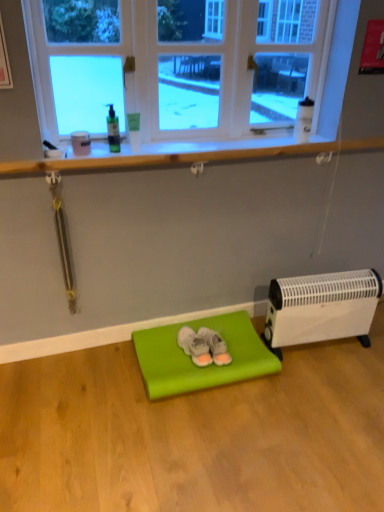
Question: Is gray suede slippers at center, acting as the 1th footwear starting from the left, bigger than white plastic heater at lower right?

Choices:
 (A) no
 (B) yes

Answer: (A)

Question: Does gray suede slippers at center, acting as the 1th footwear starting from the left, come behind white plastic heater at lower right?

Choices:
 (A) no
 (B) yes

Answer: (B)

Question: Considering the relative sizes of gray suede slippers at center, acting as the 2th footwear starting from the right, and white plastic heater at lower right in the image provided, is gray suede slippers at center, acting as the 2th footwear starting from the right, smaller than white plastic heater at lower right?

Choices:
 (A) no
 (B) yes

Answer: (B)

Question: Does gray suede slippers at center, acting as the 1th footwear starting from the left, have a lesser height compared to white plastic heater at lower right?

Choices:
 (A) no
 (B) yes

Answer: (B)

Question: Could you tell me if gray suede slippers at center, acting as the 1th footwear starting from the left, is facing white plastic heater at lower right?

Choices:
 (A) no
 (B) yes

Answer: (A)

Question: From the image's perspective, is matte green yoga mat at center above or below white suede sneakers at center, the second footwear in the left-to-right sequence?

Choices:
 (A) below
 (B) above

Answer: (A)

Question: From their relative heights in the image, would you say matte green yoga mat at center is taller or shorter than white suede sneakers at center, which is the 1th footwear in right-to-left order?

Choices:
 (A) tall
 (B) short

Answer: (B)

Question: Considering the positions of matte green yoga mat at center and white suede sneakers at center, which is the 1th footwear in right-to-left order, in the image, is matte green yoga mat at center bigger or smaller than white suede sneakers at center, which is the 1th footwear in right-to-left order,?

Choices:
 (A) small
 (B) big

Answer: (B)

Question: Relative to white suede sneakers at center, which is the 1th footwear in right-to-left order, is matte green yoga mat at center in front or behind?

Choices:
 (A) behind
 (B) front

Answer: (B)

Question: Is clear glass window at upper center wider or thinner than white suede sneakers at center, the second footwear in the left-to-right sequence?

Choices:
 (A) wide
 (B) thin

Answer: (B)

Question: Is clear glass window at upper center in front of or behind white suede sneakers at center, which is the 1th footwear in right-to-left order, in the image?

Choices:
 (A) front
 (B) behind

Answer: (A)

Question: From the image's perspective, is clear glass window at upper center located above or below white suede sneakers at center, which is the 1th footwear in right-to-left order?

Choices:
 (A) above
 (B) below

Answer: (A)

Question: Is clear glass window at upper center taller or shorter than white suede sneakers at center, the second footwear in the left-to-right sequence?

Choices:
 (A) tall
 (B) short

Answer: (A)

Question: From a real-world perspective, is clear glass window at upper center positioned above or below matte green yoga mat at center?

Choices:
 (A) above
 (B) below

Answer: (A)

Question: Considering the positions of point (187, 112) and point (178, 390), is point (187, 112) closer or farther from the camera than point (178, 390)?

Choices:
 (A) farther
 (B) closer

Answer: (A)